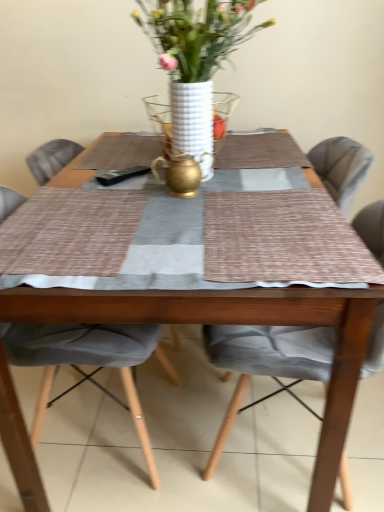
Where is `vacant area on top of wooden table at center (from a real-world perspective)`? This screenshot has height=512, width=384. vacant area on top of wooden table at center (from a real-world perspective) is located at coordinates (195, 190).